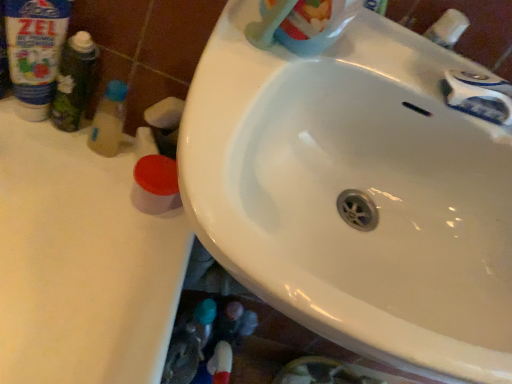
In order to click on white plastic toothbrush at upper right in this screenshot , I will do `click(479, 96)`.

Image resolution: width=512 pixels, height=384 pixels. What do you see at coordinates (74, 82) in the screenshot?
I see `green matte bottle at left, acting as the first toiletry starting from the left` at bounding box center [74, 82].

The width and height of the screenshot is (512, 384). I want to click on white plastic faucet at upper right, so click(x=448, y=28).

Locate an element on the screen. This screenshot has height=384, width=512. blue plastic bottle at upper left, acting as the 2th cleaning product starting from the front is located at coordinates (35, 52).

What do you see at coordinates (315, 25) in the screenshot?
I see `translucent plastic toothbrush at upper center, the 2th cleaning product in the left-to-right sequence` at bounding box center [315, 25].

Identify the location of translucent plastic toothbrush at upper center, which is counted as the 1th cleaning product, starting from the right. This screenshot has height=384, width=512. (315, 25).

Where is `white plastic toothbrush at upper right`? white plastic toothbrush at upper right is located at coordinates (479, 96).

Are white plastic toothbrush at upper right and white glossy sink at center located far from each other?

No, white plastic toothbrush at upper right is in close proximity to white glossy sink at center.

Does point (505, 83) lie in front of point (426, 256)?

Yes, it is in front of point (426, 256).

Between white plastic toothbrush at upper right and white glossy sink at center, which one has larger width?

Wider between the two is white glossy sink at center.

Based on the photo, is translucent plastic bottle at left, the 1th toiletry viewed from the right, not inside white plastic faucet at upper right?

Indeed, translucent plastic bottle at left, the 1th toiletry viewed from the right, is completely outside white plastic faucet at upper right.

Which of these two, translucent plastic bottle at left, the 1th toiletry viewed from the right, or white plastic faucet at upper right, is bigger?

translucent plastic bottle at left, the 1th toiletry viewed from the right.

Considering the positions of objects translucent plastic bottle at left, the 1th toiletry viewed from the right, and white plastic faucet at upper right in the image provided, who is in front, translucent plastic bottle at left, the 1th toiletry viewed from the right, or white plastic faucet at upper right?

white plastic faucet at upper right is in front.

How different are the orientations of white glossy sink at center and white plastic faucet at upper right in degrees?

The facing directions of white glossy sink at center and white plastic faucet at upper right are 0.833 degrees apart.

Who is bigger, white glossy sink at center or white plastic faucet at upper right?

Bigger between the two is white glossy sink at center.

Considering the relative sizes of white glossy sink at center and white plastic faucet at upper right in the image provided, is white glossy sink at center taller than white plastic faucet at upper right?

Yes.

Is white glossy sink at center situated inside white plastic faucet at upper right or outside?

white glossy sink at center exists outside the volume of white plastic faucet at upper right.

At what (x,y) coordinates should I click in order to perform the action: click on toiletry that is the 1st object located behind the white plastic toothbrush at upper right. Please return your answer as a coordinate pair (x, y). Looking at the image, I should click on (74, 82).

Is green matte bottle at left, acting as the first toiletry starting from the left, wider than white plastic toothbrush at upper right?

Correct, the width of green matte bottle at left, acting as the first toiletry starting from the left, exceeds that of white plastic toothbrush at upper right.

Which is behind, point (62, 130) or point (446, 77)?

Positioned behind is point (62, 130).

Are green matte bottle at left, the second toiletry in the right-to-left sequence, and white plastic toothbrush at upper right making contact?

There is a gap between green matte bottle at left, the second toiletry in the right-to-left sequence, and white plastic toothbrush at upper right.

Is white glossy sink at center looking in the opposite direction of green matte bottle at left, acting as the first toiletry starting from the left?

No, white glossy sink at center is not facing away from green matte bottle at left, acting as the first toiletry starting from the left.

How far apart are white glossy sink at center and green matte bottle at left, acting as the first toiletry starting from the left?

white glossy sink at center is 15.62 inches from green matte bottle at left, acting as the first toiletry starting from the left.

Is point (232, 157) positioned after point (64, 55)?

That is False.

Between white glossy sink at center and green matte bottle at left, the second toiletry in the right-to-left sequence, which one has larger width?

white glossy sink at center.

Is point (470, 79) positioned before point (120, 135)?

Yes, point (470, 79) is in front of point (120, 135).

Who is bigger, white plastic toothbrush at upper right or translucent plastic bottle at left, marked as the second toiletry in a left-to-right arrangement?

white plastic toothbrush at upper right is bigger.

Is white plastic toothbrush at upper right to the right of translucent plastic bottle at left, marked as the second toiletry in a left-to-right arrangement, from the viewer's perspective?

Correct, you'll find white plastic toothbrush at upper right to the right of translucent plastic bottle at left, marked as the second toiletry in a left-to-right arrangement.

From the picture: Considering the sizes of white plastic toothbrush at upper right and translucent plastic bottle at left, the 1th toiletry viewed from the right, in the image, is white plastic toothbrush at upper right wider or thinner than translucent plastic bottle at left, the 1th toiletry viewed from the right,?

Considering their sizes, white plastic toothbrush at upper right looks broader than translucent plastic bottle at left, the 1th toiletry viewed from the right.

Between point (21, 96) and point (496, 115), which one is positioned in front?

Point (496, 115)

Is white plastic toothbrush at upper right a part of blue plastic bottle at upper left, positioned as the second cleaning product in right-to-left order?

No, white plastic toothbrush at upper right is not surrounded by blue plastic bottle at upper left, positioned as the second cleaning product in right-to-left order.

Considering the relative sizes of blue plastic bottle at upper left, positioned as the second cleaning product in right-to-left order, and white plastic toothbrush at upper right in the image provided, is blue plastic bottle at upper left, positioned as the second cleaning product in right-to-left order, smaller than white plastic toothbrush at upper right?

Actually, blue plastic bottle at upper left, positioned as the second cleaning product in right-to-left order, might be larger than white plastic toothbrush at upper right.

This screenshot has height=384, width=512. I want to click on plumbing fixture located above the white glossy sink at center (from the image's perspective), so click(479, 96).

Find the location of `faucet above the translucent plastic bottle at left, marked as the second toiletry in a left-to-right arrangement (from a real-world perspective)`. faucet above the translucent plastic bottle at left, marked as the second toiletry in a left-to-right arrangement (from a real-world perspective) is located at coordinates (448, 28).

Looking at the image, which one is located further to white plastic faucet at upper right, translucent plastic bottle at left, the 1th toiletry viewed from the right, or green matte bottle at left, the second toiletry in the right-to-left sequence?

The object further to white plastic faucet at upper right is green matte bottle at left, the second toiletry in the right-to-left sequence.

Based on their spatial positions, is green matte bottle at left, the second toiletry in the right-to-left sequence, or white glossy sink at center further from translucent plastic bottle at left, the 1th toiletry viewed from the right?

The object further to translucent plastic bottle at left, the 1th toiletry viewed from the right, is white glossy sink at center.

Estimate the real-world distances between objects in this image. Which object is closer to green matte bottle at left, the second toiletry in the right-to-left sequence, translucent plastic toothbrush at upper center, the 2th cleaning product in the left-to-right sequence, or blue plastic bottle at upper left, which is the first cleaning product in left-to-right order?

blue plastic bottle at upper left, which is the first cleaning product in left-to-right order.

From the image, which object appears to be nearer to white plastic faucet at upper right, white plastic toothbrush at upper right or green matte bottle at left, acting as the first toiletry starting from the left?

Among the two, white plastic toothbrush at upper right is located nearer to white plastic faucet at upper right.

When comparing their distances from blue plastic bottle at upper left, which is the first cleaning product in left-to-right order, does green matte bottle at left, acting as the first toiletry starting from the left, or translucent plastic toothbrush at upper center, the 2th cleaning product in the left-to-right sequence, seem closer?

green matte bottle at left, acting as the first toiletry starting from the left, lies closer to blue plastic bottle at upper left, which is the first cleaning product in left-to-right order, than the other object.

Estimate the real-world distances between objects in this image. Which object is further from white plastic faucet at upper right, green matte bottle at left, acting as the first toiletry starting from the left, or translucent plastic bottle at left, the 1th toiletry viewed from the right?

green matte bottle at left, acting as the first toiletry starting from the left.

From the image, which object appears to be nearer to green matte bottle at left, acting as the first toiletry starting from the left, white plastic faucet at upper right or translucent plastic toothbrush at upper center, the first cleaning product positioned from the front?

The object closer to green matte bottle at left, acting as the first toiletry starting from the left, is translucent plastic toothbrush at upper center, the first cleaning product positioned from the front.

Which object lies nearer to the anchor point white plastic toothbrush at upper right, green matte bottle at left, the second toiletry in the right-to-left sequence, or white glossy sink at center?

white glossy sink at center is closer to white plastic toothbrush at upper right.

Locate an element on the screen. cleaning product between white glossy sink at center and white plastic toothbrush at upper right from front to back is located at coordinates (315, 25).

Identify the location of cleaning product located between green matte bottle at left, the second toiletry in the right-to-left sequence, and white glossy sink at center in the left-right direction. (315, 25).

At what (x,y) coordinates should I click in order to perform the action: click on toiletry between green matte bottle at left, the second toiletry in the right-to-left sequence, and translucent plastic toothbrush at upper center, the first cleaning product positioned from the front, in the horizontal direction. Please return your answer as a coordinate pair (x, y). Looking at the image, I should click on (109, 120).

The height and width of the screenshot is (384, 512). In order to click on toiletry between green matte bottle at left, the second toiletry in the right-to-left sequence, and white plastic faucet at upper right, in the horizontal direction in this screenshot , I will do `click(109, 120)`.